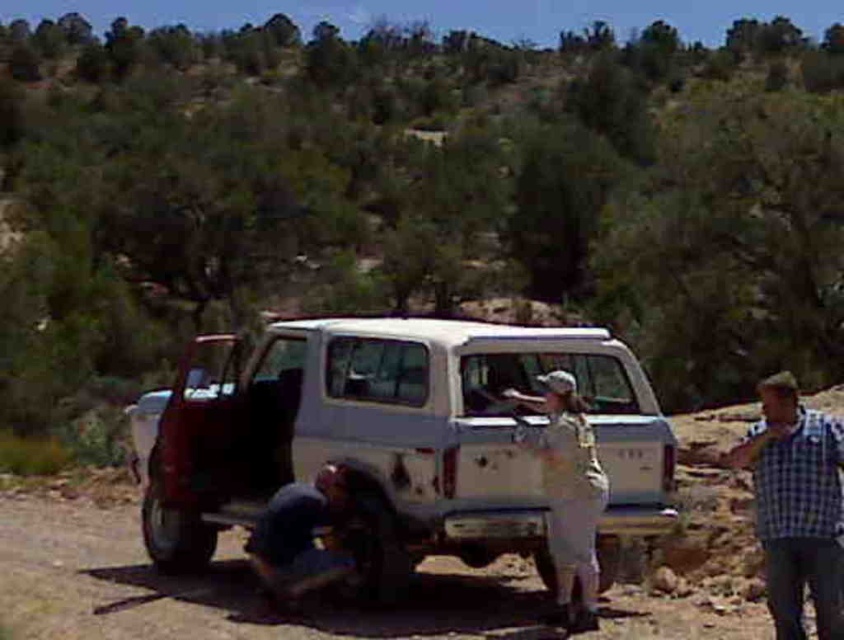
You are a hiker who needs to reach a trailhead located to the right of the blue checkered shirt at right. Since you are standing near the white matte jeep at center, which is on the left side of the shirt, should you walk to your left or right to reach the trailhead?

Result: The white matte jeep at center is positioned on the left side of the blue checkered shirt at right. To reach the trailhead located to the right of the blue checkered shirt at right, you should walk to your right from the white matte jeep at center.

You are standing at the edge of the dirt field at lower center and want to reach the blue checkered shirt at right. Which direction should you move to get closer to the shirt?

The dirt field at lower center is not as tall as blue checkered shirt at right, so you should move forward towards the shirt since it is positioned higher up relative to the field.